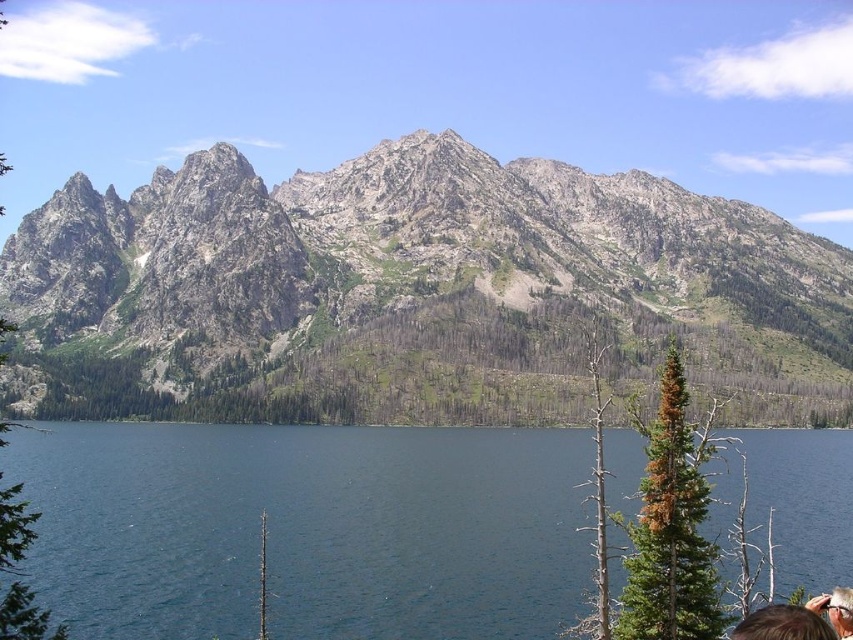
You are a hiker planning to take a photo of the rocky gray mountain at upper center and the deep blue water at center. Which object should you focus on first if you want both to be in sharp focus?

The rocky gray mountain at upper center is taller than the deep blue water at center, so you should focus on the rocky gray mountain at upper center first to ensure both are in sharp focus.

You are a hiker standing at the point marked by the coordinates point (410, 292) in the image. Based on the scene, what type of terrain are you currently standing on?

The point (410, 292) marks rocky gray mountain at upper center, so you are standing on rocky terrain.